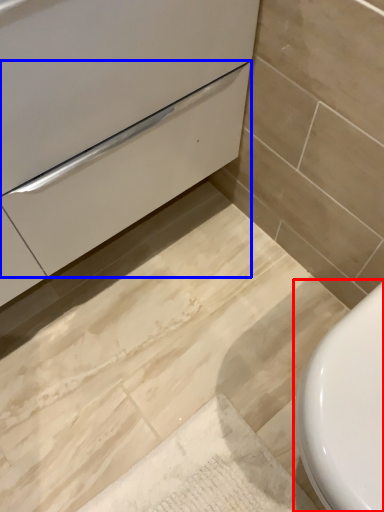
Question: Which of the following is the closest to the observer, toilet (highlighted by a red box) or drawer (highlighted by a blue box)?

Choices:
 (A) toilet
 (B) drawer

Answer: (B)